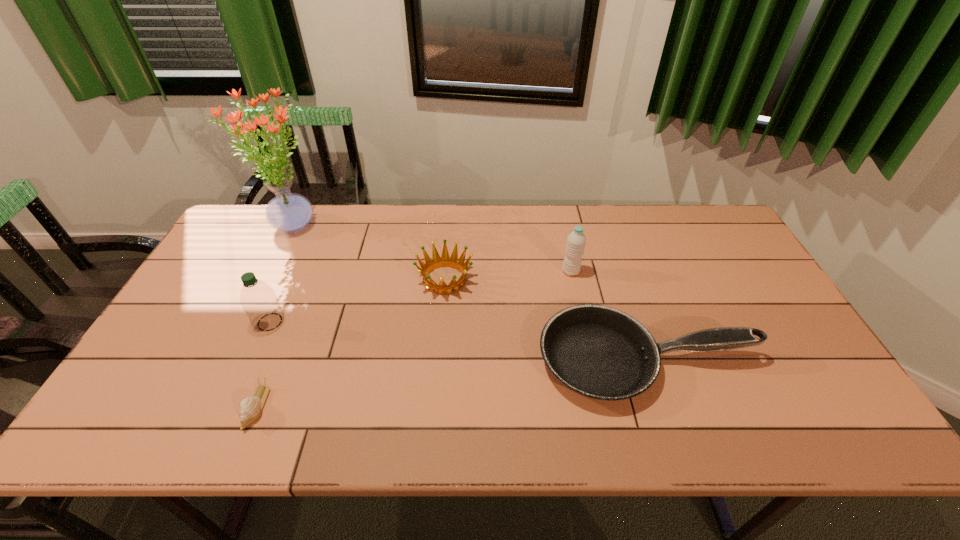
Image resolution: width=960 pixels, height=540 pixels. Find the location of `free space located on the right of the crown`. free space located on the right of the crown is located at coordinates (550, 279).

This screenshot has width=960, height=540. Identify the location of free spot located 0.340m on the left of the frying pan. point(403,360).

This screenshot has height=540, width=960. I want to click on object located at the far edge, so click(290, 212).

Find the location of a particular element. The width and height of the screenshot is (960, 540). frying pan situated at the near edge is located at coordinates (599, 352).

The height and width of the screenshot is (540, 960). I want to click on escargot that is at the near edge, so click(x=249, y=409).

The width and height of the screenshot is (960, 540). Find the location of `object that is positioned at the left edge`. object that is positioned at the left edge is located at coordinates (290, 212).

This screenshot has height=540, width=960. I want to click on object located at the right edge, so click(x=599, y=352).

This screenshot has height=540, width=960. Find the location of `object at the far left corner`. object at the far left corner is located at coordinates (290, 212).

Image resolution: width=960 pixels, height=540 pixels. Identify the location of object located at the near right corner. (599, 352).

Where is `free spot at the far edge of the desktop`? Image resolution: width=960 pixels, height=540 pixels. free spot at the far edge of the desktop is located at coordinates (548, 222).